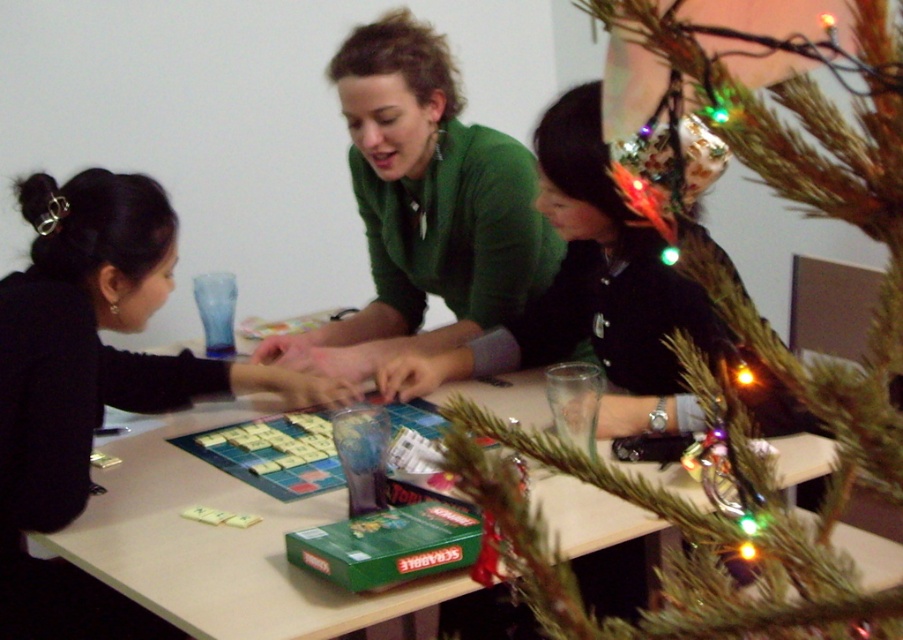
You are a photographer trying to capture a closeup of the Scrabble game pieces. You notice two points of interest marked as point 1 at coordinates point (555, 529) and point 2 at coordinates point (376, 115). Which point should you focus on to get a clearer image of the game pieces?

Point (555, 529) is closer to the camera than point (376, 115), so focusing on point (555, 529) will result in a clearer image of the game pieces.

You are organizing a small party and need to place a new decoration on the table. The decoration requires a space larger than the black matte shirt at center. Can the green artificial tree at center provide enough space for it?

The green artificial tree at center is larger in size than the black matte shirt at center, so it can provide enough space for the decoration that requires a larger area than the black matte shirt at center.

In the scene shown: You are a photographer trying to capture a group photo of the three individuals seated around the table. The green artificial tree at center and the black matte shirt at center are both in the frame. Which object is shorter in the scene?

The green artificial tree at center has a lesser height compared to the black matte shirt at center, so the green artificial tree at center is shorter.